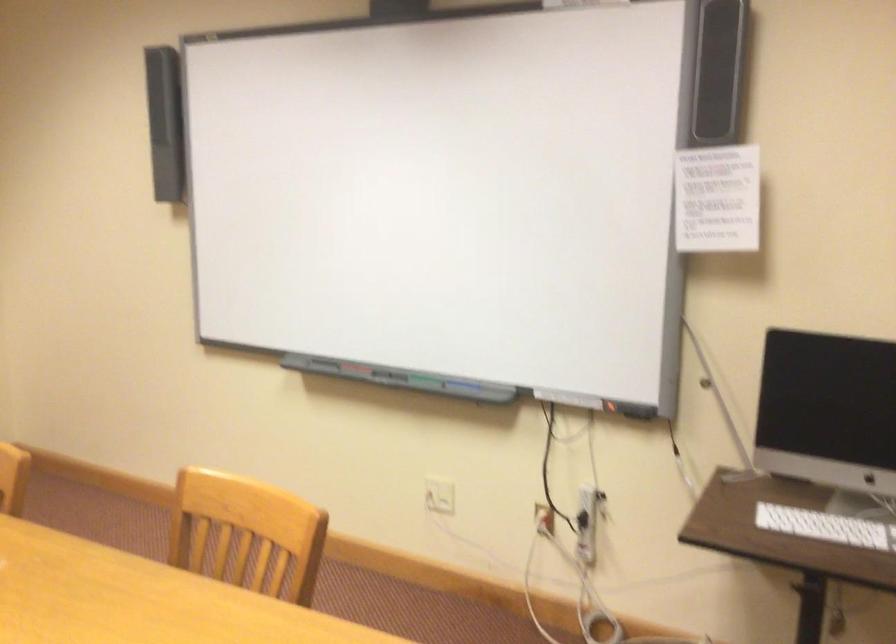
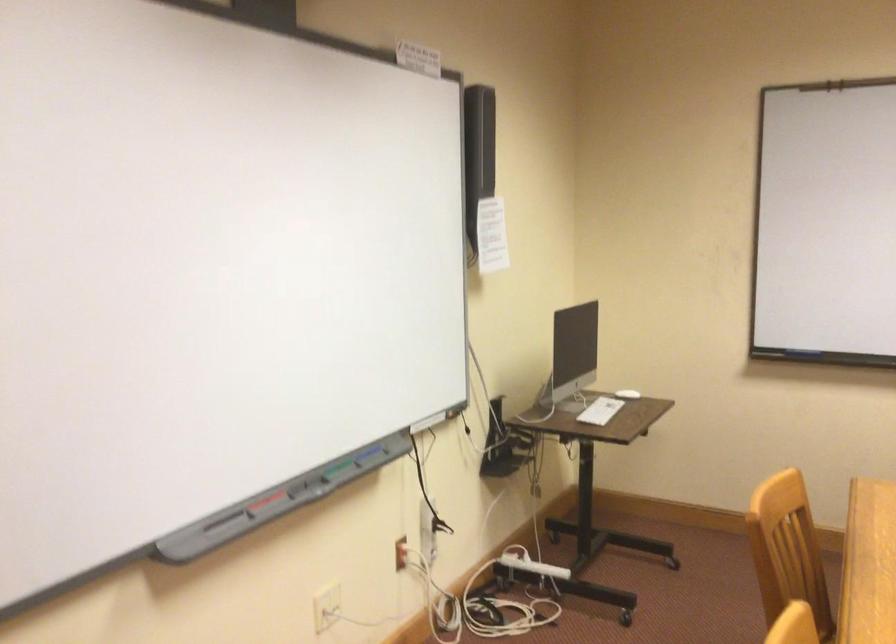
In the second image, find the point that corresponds to the point at 433,382 in the first image.

(333, 468)